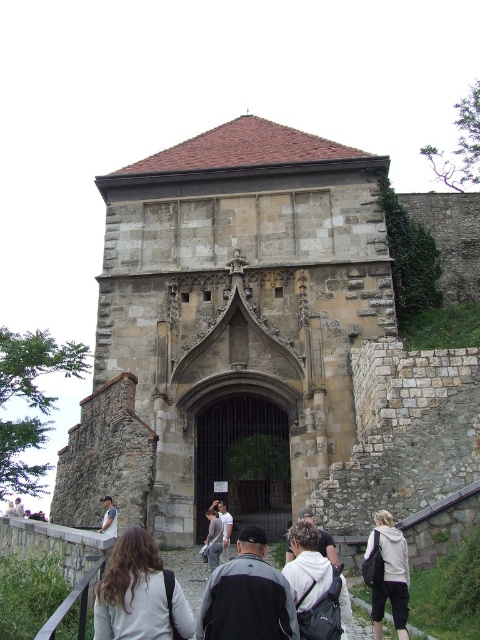
Question: Which of the following is the closest to the observer?

Choices:
 (A) stone gothic church at center
 (B) light gray hoodie at center
 (C) dark gray fabric jacket at center

Answer: (C)

Question: Is stone gothic church at center to the left of light brown leather jacket at lower left from the viewer's perspective?

Choices:
 (A) no
 (B) yes

Answer: (A)

Question: Which object is closer to the camera taking this photo?

Choices:
 (A) stone gothic church at center
 (B) dark gray fabric jacket at center
 (C) gray fleece jacket at center
 (D) light brown leather jacket at lower left

Answer: (B)

Question: Which object is the farthest from the gray fabric backpack at center?

Choices:
 (A) gray fleece jacket at center
 (B) dark gray fabric jacket at center
 (C) dark gray fabric backpack at center

Answer: (B)

Question: Observing the image, what is the correct spatial positioning of dark gray fabric jacket at center in reference to gray fabric backpack at center?

Choices:
 (A) above
 (B) below

Answer: (A)

Question: Where is light gray hoodie at center located in relation to gray fabric backpack at center in the image?

Choices:
 (A) left
 (B) right

Answer: (B)